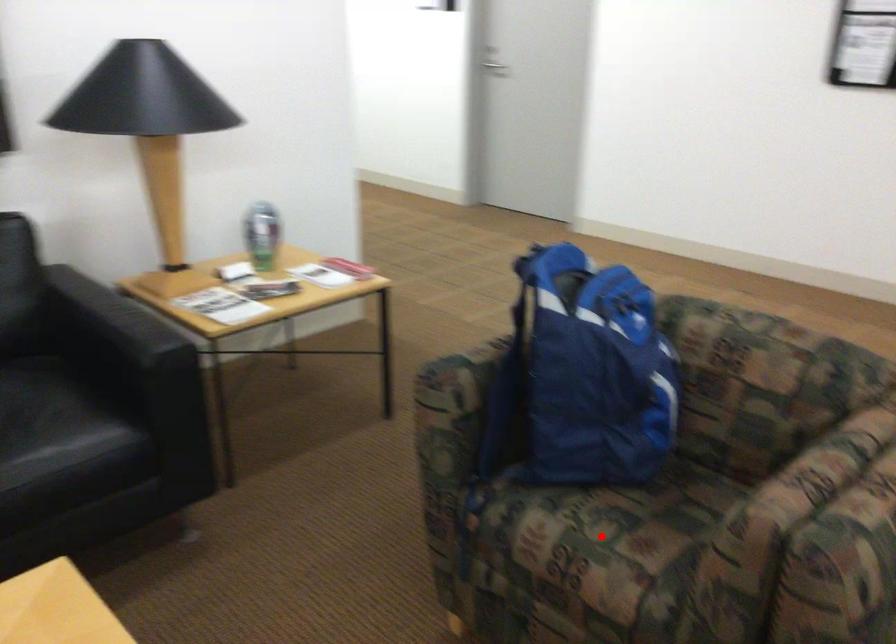
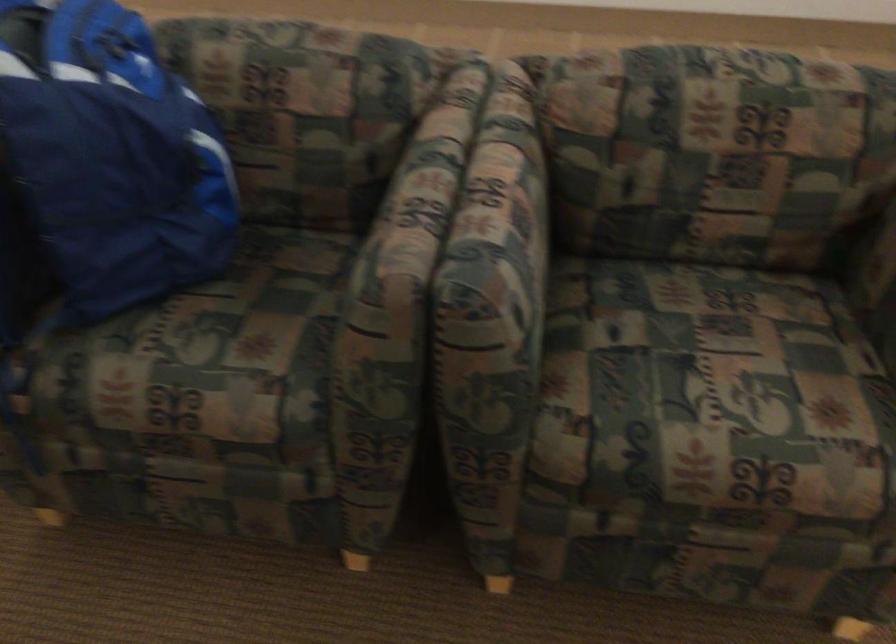
Locate, in the second image, the point that corresponds to the highlighted location in the first image.

(199, 353)